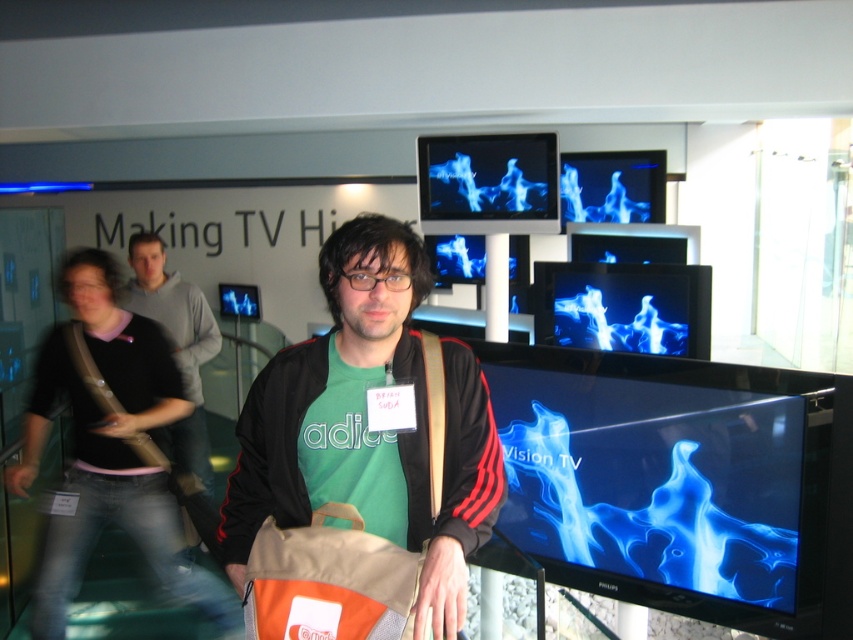
Question: Is green fabric shirt at center wider than green cotton t-shirt at center?

Choices:
 (A) yes
 (B) no

Answer: (B)

Question: Which object appears closest to the camera in this image?

Choices:
 (A) green fabric shirt at center
 (B) green cotton t-shirt at center

Answer: (A)

Question: Which object appears closest to the camera in this image?

Choices:
 (A) green cotton t-shirt at center
 (B) green fabric shirt at center

Answer: (B)

Question: Does green fabric shirt at center have a greater width compared to green cotton t-shirt at center?

Choices:
 (A) yes
 (B) no

Answer: (B)

Question: Can you confirm if green fabric shirt at center is smaller than green cotton t-shirt at center?

Choices:
 (A) yes
 (B) no

Answer: (A)